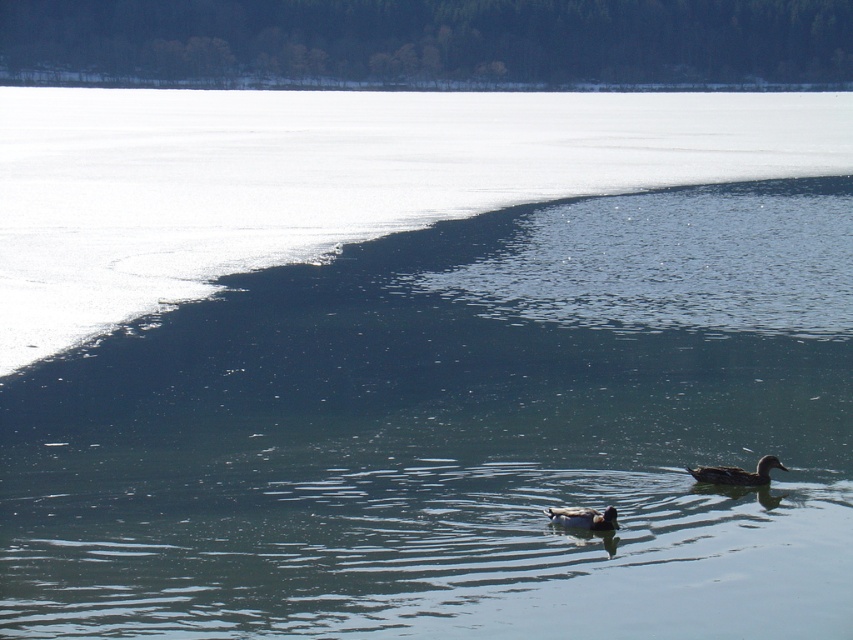
You are standing at the point with coordinates point (543, 513) and want to walk towards the point with coordinates point (738, 483). Given the winter scene described, will you have to walk over the unfrozen dark blue water or the white opaque ice?

Since point (738, 483) is behind point (543, 513), you would be walking towards the unfrozen dark blue water area. Therefore, you will have to walk over the unfrozen dark blue water.

You are a photographer trying to capture both the brown glossy duck at lower right and the brown matte duck at center in a single shot. Which duck is closer to the left edge of your camera frame?

The brown glossy duck at lower right is positioned on the right side of the brown matte duck at center, meaning the brown matte duck at center is closer to the left edge of the camera frame.